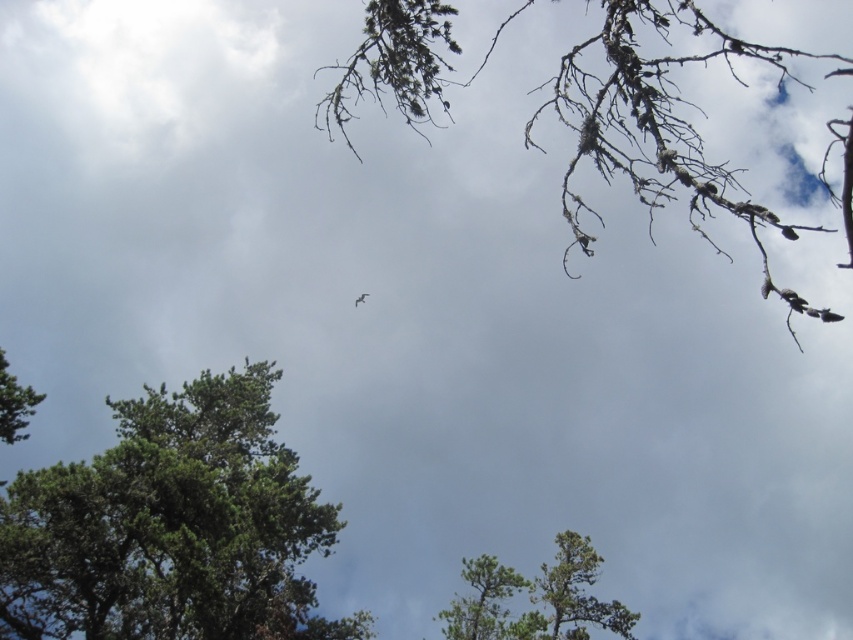
Who is higher up, green leafy tree at upper left or dead wood branches at upper right?

dead wood branches at upper right is above.

Find the location of a particular element. Image resolution: width=853 pixels, height=640 pixels. green leafy tree at upper left is located at coordinates (171, 528).

Which is in front, point (453, 634) or point (27, 387)?

Positioned in front is point (27, 387).

Is green matte tree at center above green matte tree at lower left?

Incorrect, green matte tree at center is not positioned above green matte tree at lower left.

Is point (492, 596) farther from camera compared to point (24, 422)?

Yes, it is behind point (24, 422).

At what (x,y) coordinates should I click in order to perform the action: click on green matte tree at center. Please return your answer as a coordinate pair (x, y). This screenshot has width=853, height=640. Looking at the image, I should click on (485, 602).

Is point (532, 634) behind point (509, 637)?

No, (532, 634) is in front of (509, 637).

Can you confirm if green matte tree at lower center is smaller than green matte tree at center?

Correct, green matte tree at lower center occupies less space than green matte tree at center.

Describe the element at coordinates (575, 593) in the screenshot. I see `green matte tree at lower center` at that location.

At what (x,y) coordinates should I click in order to perform the action: click on green matte tree at lower center. Please return your answer as a coordinate pair (x, y). Looking at the image, I should click on (575, 593).